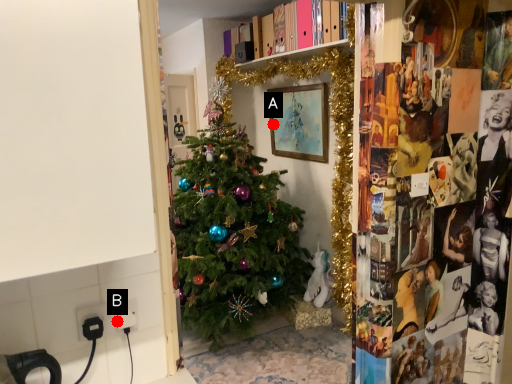
Question: Two points are circled on the image, labeled by A and B beside each circle. Among these points, which one is nearest to the camera?

Choices:
 (A) A is closer
 (B) B is closer

Answer: (B)